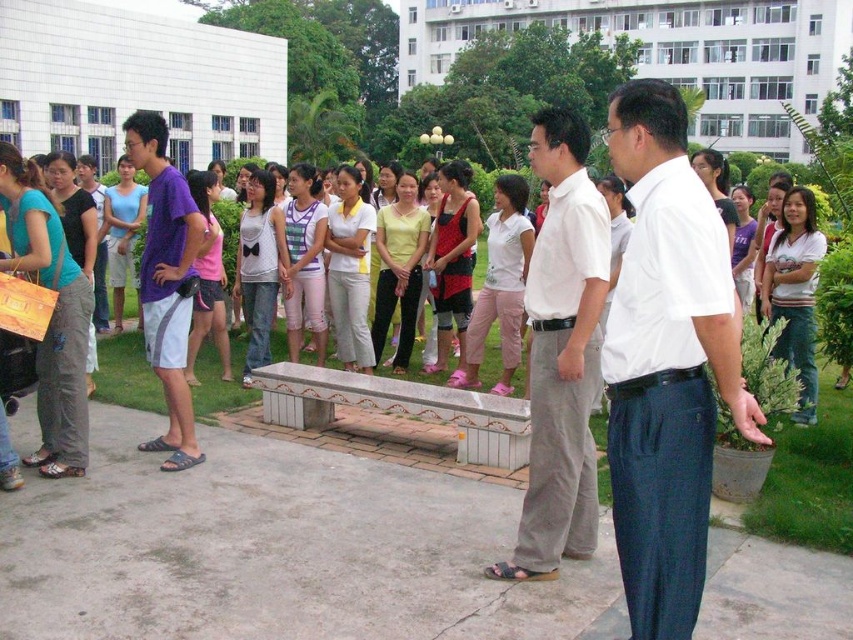
You are a photographer trying to capture a clear photo of the white cotton shirt at center and the white striped shirt at center. Since both are in the same area, which one should you focus on to ensure the other is still in the background?

You should focus on the white cotton shirt at center because it is in front of the white striped shirt at center, so the latter will naturally appear in the background.

You are a photographer at the event and need to capture both men in a single photo. The camera you have can only focus on objects within a 1.5 meter height range. Given that the white smooth shirt at center is shorter than the white cotton shirt at center, will both men fit within the camera focus range?

The white smooth shirt at center is shorter than the white cotton shirt at center. Assuming the height difference between them is within 1.5 meters, both men would fit within the camera focus range. However, if the height difference exceeds 1.5 meters, the camera might not capture both clearly.